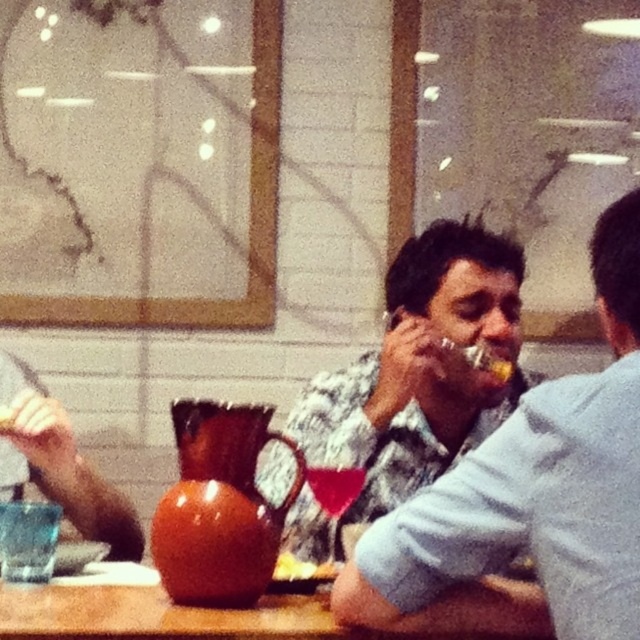
Question: From the image, what is the correct spatial relationship of matte plastic fork at center in relation to wooden table at center?

Choices:
 (A) above
 (B) below

Answer: (A)

Question: Which point appears closest to the camera in this image?

Choices:
 (A) (248, 634)
 (B) (1, 420)
 (C) (442, 509)
 (D) (324, 474)

Answer: (C)

Question: Does matte plastic fork at center have a smaller size compared to matte orange glass at center?

Choices:
 (A) yes
 (B) no

Answer: (B)

Question: Based on their relative distances, which object is farther from the matte orange glass at center?

Choices:
 (A) wooden table at center
 (B) floral-patterned shirt at center
 (C) translucent glass at center
 (D) matte plastic fork at center

Answer: (D)

Question: Estimate the real-world distances between objects in this image. Which object is farther from the wooden table at center?

Choices:
 (A) floral-patterned shirt at center
 (B) matte orange glass at center
 (C) matte plastic fork at center

Answer: (B)

Question: Does floral-patterned shirt at center appear over wooden table at center?

Choices:
 (A) no
 (B) yes

Answer: (B)